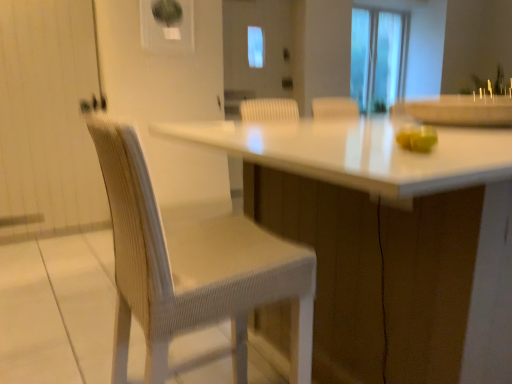
Question: Is transparent glass screen door at center inside or outside of green matte apple at right?

Choices:
 (A) inside
 (B) outside

Answer: (B)

Question: From a real-world perspective, is transparent glass screen door at center positioned above or below green matte apple at right?

Choices:
 (A) above
 (B) below

Answer: (A)

Question: Which object is positioned closest to the transparent glass screen door at center?

Choices:
 (A) white glossy table at center
 (B) green matte apple at right

Answer: (A)

Question: Estimate the real-world distances between objects in this image. Which object is closer to the green matte apple at right?

Choices:
 (A) white glossy table at center
 (B) transparent glass screen door at center

Answer: (A)